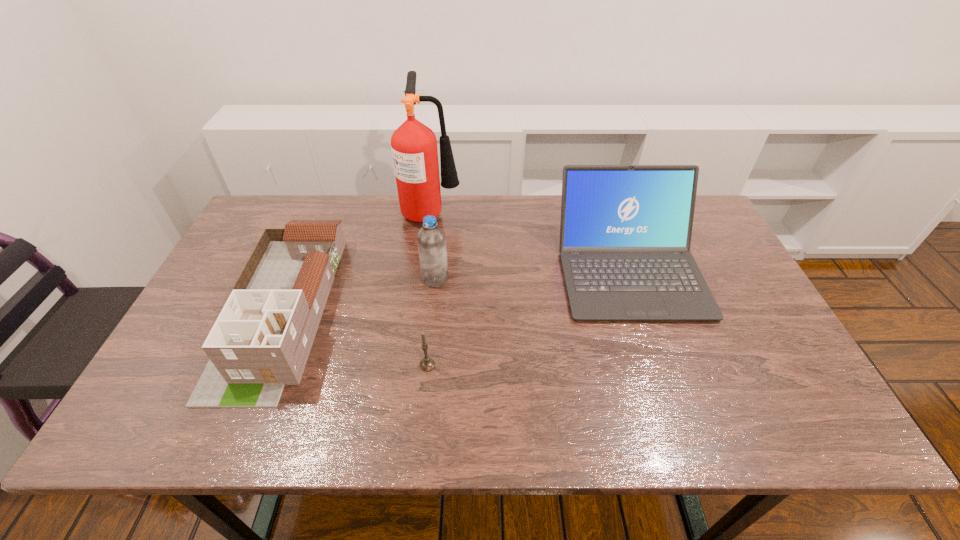
You are a GUI agent. You are given a task and a screenshot of the screen. Output one action in this format:
    pyautogui.click(x=<x>, y=<y>)
    Task: Click on the free location that satisfies the following two spatial constraints: 1. at the nozzle of the fire extinguisher; 2. at the main entrance of the second shortest object
    Image resolution: width=960 pixels, height=540 pixels.
    Given the screenshot: What is the action you would take?
    pyautogui.click(x=419, y=310)